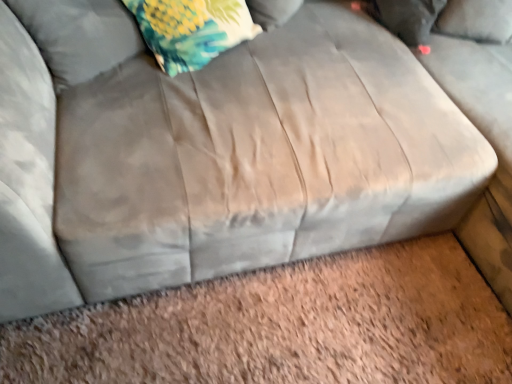
Question: Is fluffy fabric pillow at upper left, positioned as the second pillow in right-to-left order, further to camera compared to floral fabric pillow at upper left, positioned as the 2th pillow in front-to-back order?

Choices:
 (A) yes
 (B) no

Answer: (B)

Question: Is fluffy fabric pillow at upper left, positioned as the second pillow in right-to-left order, next to floral fabric pillow at upper left, marked as the second pillow in a left-to-right arrangement?

Choices:
 (A) yes
 (B) no

Answer: (B)

Question: Is fluffy fabric pillow at upper left, the 2th pillow from the back, thinner than floral fabric pillow at upper left, placed as the 1th pillow when sorted from back to front?

Choices:
 (A) yes
 (B) no

Answer: (B)

Question: Does fluffy fabric pillow at upper left, the 2th pillow from the back, have a greater height compared to floral fabric pillow at upper left, placed as the 1th pillow when sorted from back to front?

Choices:
 (A) yes
 (B) no

Answer: (A)

Question: Is fluffy fabric pillow at upper left, the 2th pillow from the back, far from floral fabric pillow at upper left, the 1th pillow from the right?

Choices:
 (A) no
 (B) yes

Answer: (B)

Question: Is fluffy fabric pillow at upper left, which appears as the first pillow when viewed from the front, smaller than floral fabric pillow at upper left, the 1th pillow from the right?

Choices:
 (A) yes
 (B) no

Answer: (B)

Question: Does fluffy fabric pillow at upper left, positioned as the second pillow in right-to-left order, have a larger size compared to floral fabric pillow at upper left?

Choices:
 (A) no
 (B) yes

Answer: (A)

Question: Does fluffy fabric pillow at upper left, the 2th pillow from the back, have a smaller size compared to floral fabric pillow at upper left?

Choices:
 (A) yes
 (B) no

Answer: (A)

Question: Is fluffy fabric pillow at upper left, which appears as the first pillow when viewed from the front, closer to the viewer compared to floral fabric pillow at upper left?

Choices:
 (A) no
 (B) yes

Answer: (B)

Question: Considering the relative sizes of fluffy fabric pillow at upper left, the 2th pillow from the back, and floral fabric pillow at upper left in the image provided, is fluffy fabric pillow at upper left, the 2th pillow from the back, thinner than floral fabric pillow at upper left?

Choices:
 (A) no
 (B) yes

Answer: (B)

Question: Considering the relative positions of fluffy fabric pillow at upper left, the 2th pillow from the back, and floral fabric pillow at upper left in the image provided, is fluffy fabric pillow at upper left, the 2th pillow from the back, to the right of floral fabric pillow at upper left from the viewer's perspective?

Choices:
 (A) no
 (B) yes

Answer: (A)

Question: Can you confirm if fluffy fabric pillow at upper left, which appears as the first pillow when viewed from the front, is wider than floral fabric pillow at upper left?

Choices:
 (A) no
 (B) yes

Answer: (A)

Question: Is floral fabric pillow at upper left, placed as the 1th pillow when sorted from back to front, not near fluffy fabric pillow at upper left, positioned as the second pillow in right-to-left order?

Choices:
 (A) yes
 (B) no

Answer: (A)